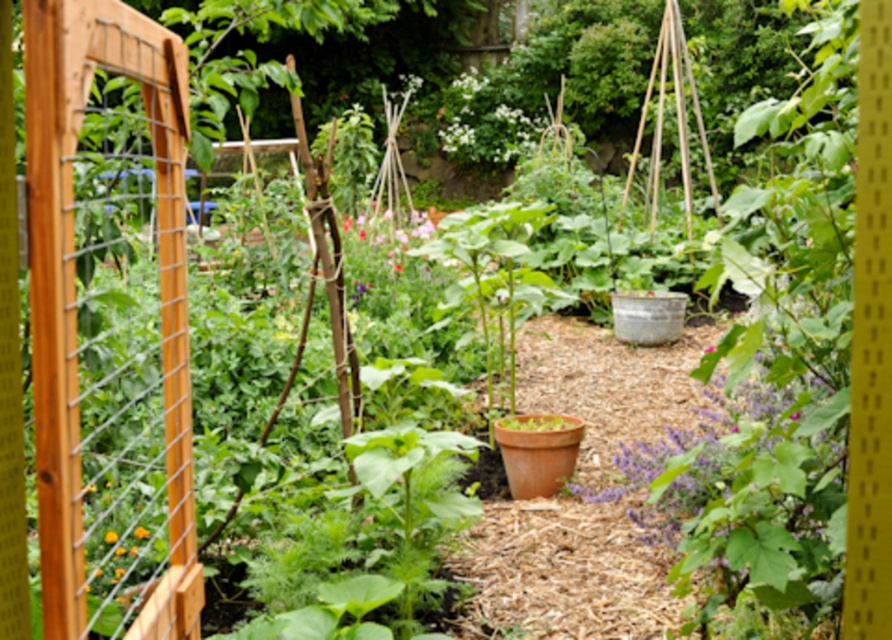
Measure the distance between pink matte flower at center and camera.

The distance of pink matte flower at center from camera is 27.48 feet.

Does pink matte flower at center have a greater height compared to orange matte flower at center?

Correct, pink matte flower at center is much taller as orange matte flower at center.

Who is more forward, (417, 216) or (117, 538)?

Point (117, 538)

Identify the location of pink matte flower at center. (382, 241).